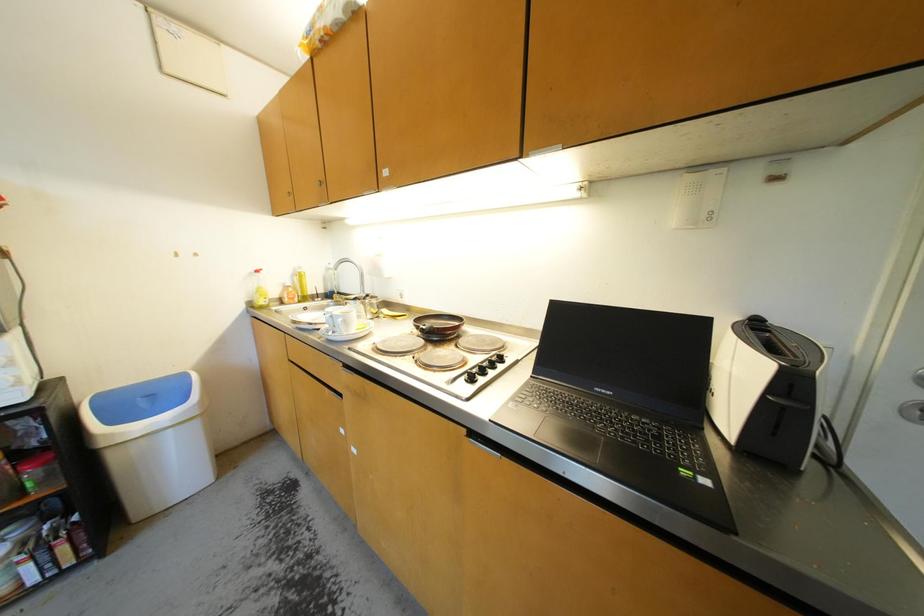
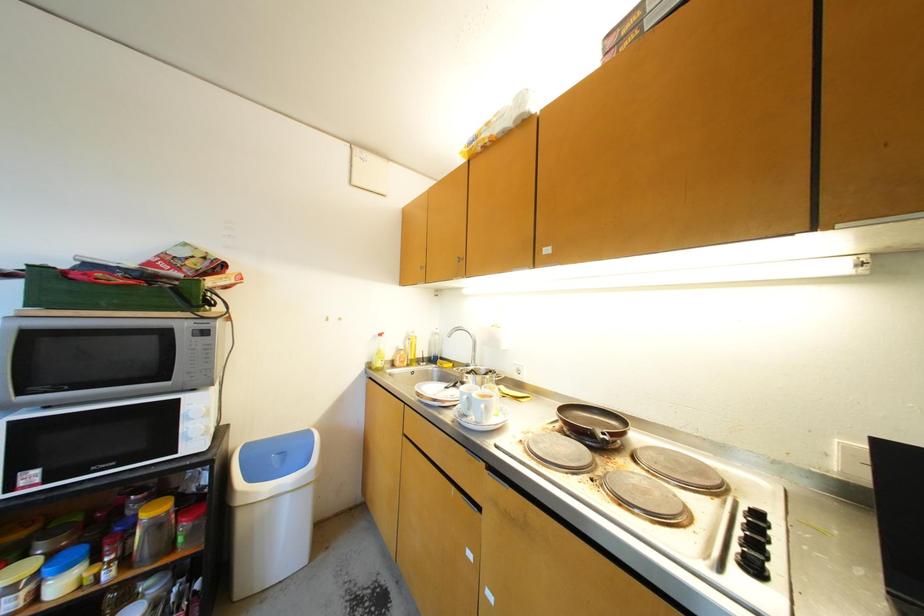
Question: Based on the continuous images, in which direction is the camera rotating? Reply with the corresponding letter.

Choices:
 (A) Left
 (B) Right
 (C) Up
 (D) Down

Answer: (A)